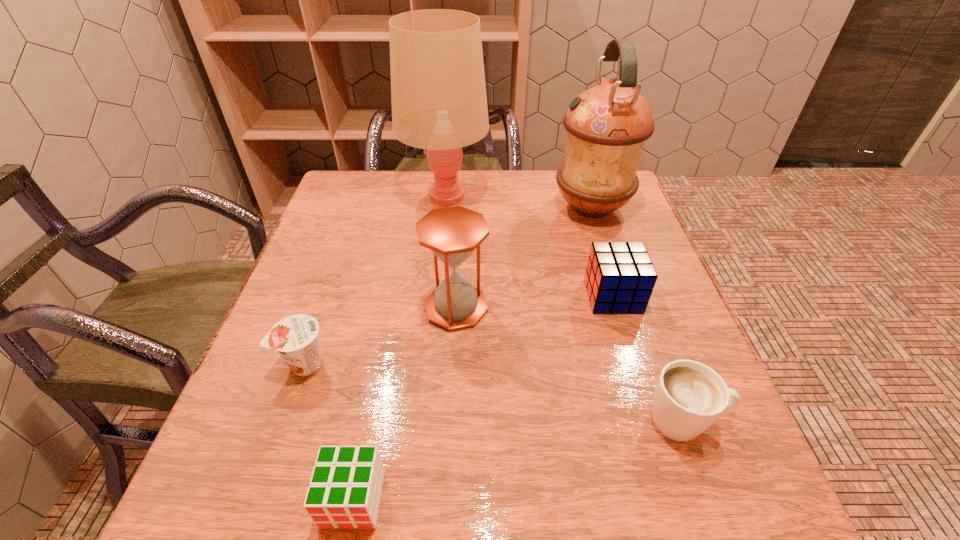
Where is `free space between the oil lamp and the lampshade`? free space between the oil lamp and the lampshade is located at coordinates (518, 201).

You are a GUI agent. You are given a task and a screenshot of the screen. Output one action in this format:
    pyautogui.click(x=<x>, y=<y>)
    Task: Click on the free area in between the hourglass and the oil lamp
    This screenshot has width=960, height=540.
    Given the screenshot: What is the action you would take?
    [524, 257]

Where is `empty location between the hourglass and the yogurt`? This screenshot has height=540, width=960. empty location between the hourglass and the yogurt is located at coordinates (380, 335).

This screenshot has height=540, width=960. I want to click on empty space that is in between the shorter cube and the third nearest object, so click(x=329, y=431).

Where is `vacant space in between the fifth shortest object and the oil lamp`? Image resolution: width=960 pixels, height=540 pixels. vacant space in between the fifth shortest object and the oil lamp is located at coordinates 524,257.

Find the location of a particular element. This screenshot has width=960, height=540. vacant area between the left cube and the third tallest object is located at coordinates (405, 403).

Locate which object ranks fifth in proximity to the oil lamp. Please provide its 2D coordinates. Your answer should be formatted as a tuple, i.e. [(x, y)], where the tuple contains the x and y coordinates of a point satisfying the conditions above.

[(295, 337)]

Where is `the closest object relative to the shorter cube`? The height and width of the screenshot is (540, 960). the closest object relative to the shorter cube is located at coordinates (295, 337).

The height and width of the screenshot is (540, 960). I want to click on vacant space that satisfies the following two spatial constraints: 1. on the back side of the fifth farthest object; 2. on the left side of the lampshade, so click(364, 195).

This screenshot has height=540, width=960. I want to click on vacant space that satisfies the following two spatial constraints: 1. with the handle on the side of the second nearest object; 2. on the red face of the left cube, so click(x=713, y=499).